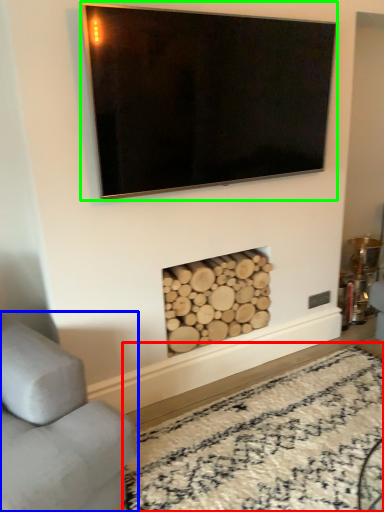
Question: Which is farther away from plain (highlighted by a red box)? studio couch (highlighted by a blue box) or television (highlighted by a green box)?

Choices:
 (A) studio couch
 (B) television

Answer: (B)